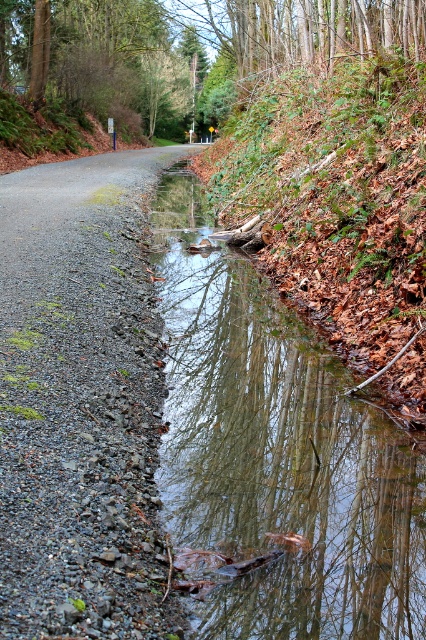
Who is more distant from viewer, (x=40, y=525) or (x=175, y=113)?

Positioned behind is point (x=175, y=113).

Who is lower down, gray gravel road at center or brown textured tree at upper center?

gray gravel road at center is lower down.

Is point (40, 522) positioned before point (385, 28)?

That is True.

Locate an element on the screen. The image size is (426, 640). gray gravel road at center is located at coordinates tap(80, 403).

Does clear water at center have a greater height compared to gray gravel road at center?

No, clear water at center is not taller than gray gravel road at center.

Describe the element at coordinates (278, 456) in the screenshot. I see `clear water at center` at that location.

Find the location of a particular element. clear water at center is located at coordinates (278, 456).

Who is more forward, (402, 321) or (78, 44)?

Positioned in front is point (402, 321).

Who is higher up, brown leafy hillside at upper right or brown textured tree at upper center?

brown textured tree at upper center is higher up.

The width and height of the screenshot is (426, 640). Describe the element at coordinates (339, 208) in the screenshot. I see `brown leafy hillside at upper right` at that location.

Find the location of a particular element. This screenshot has width=426, height=640. brown leafy hillside at upper right is located at coordinates (339, 208).